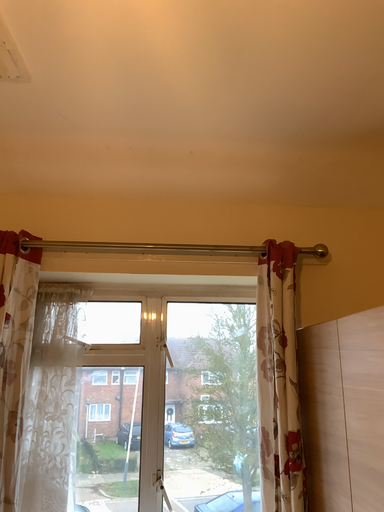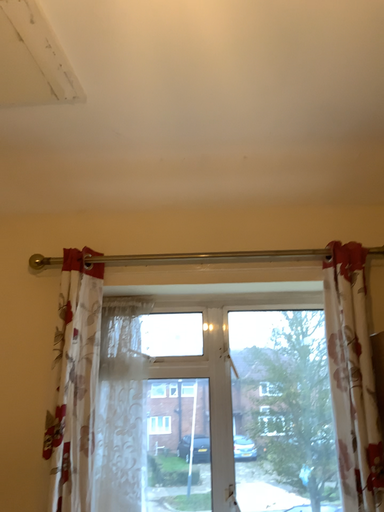
Question: How did the camera likely rotate when shooting the video?

Choices:
 (A) rotated right
 (B) rotated left

Answer: (B)